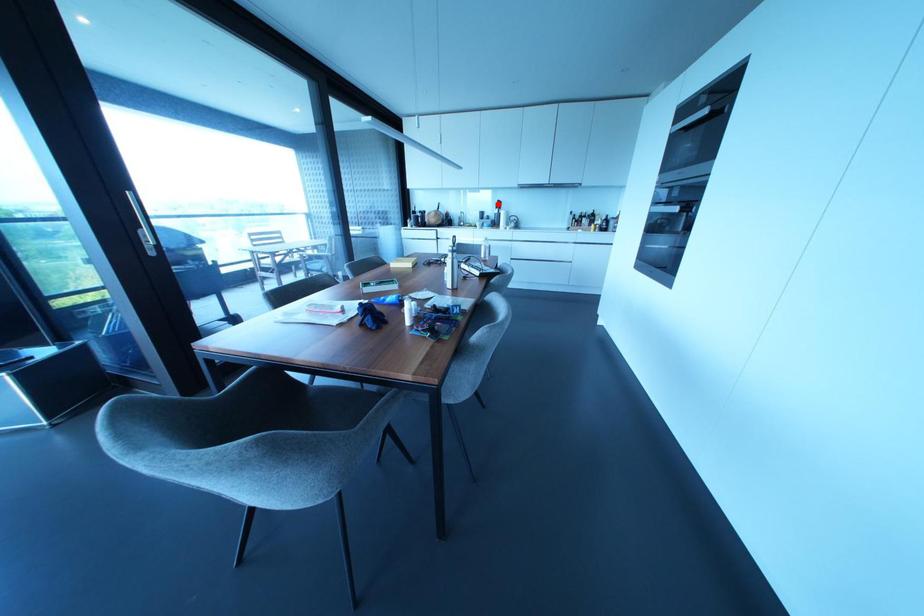
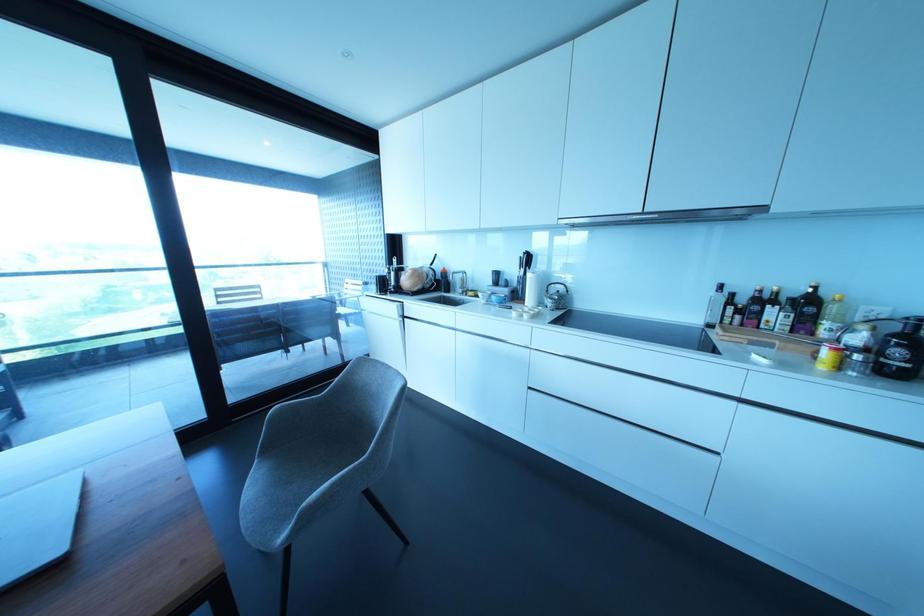
Where in the second image is the point corresponding to the highlighted location from the first image?

(527, 259)